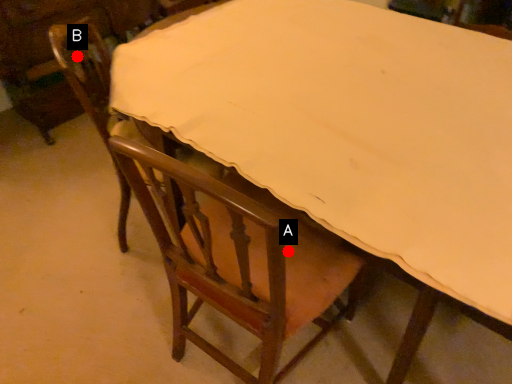
Question: Two points are circled on the image, labeled by A and B beside each circle. Among these points, which one is farthest from the camera?

Choices:
 (A) A is further
 (B) B is further

Answer: (B)